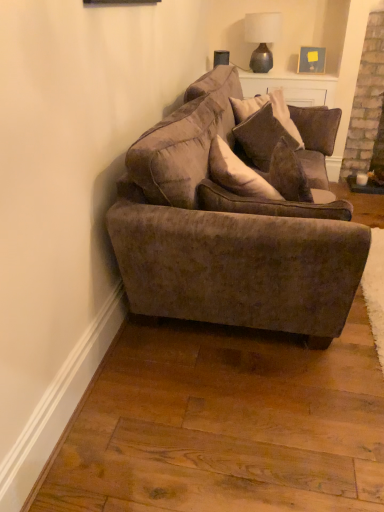
Question: In terms of size, does matte gray glass lamp at upper center appear bigger or smaller than velvet brown pillow at center?

Choices:
 (A) big
 (B) small

Answer: (A)

Question: From a real-world perspective, relative to velvet brown pillow at center, is matte gray glass lamp at upper center vertically above or below?

Choices:
 (A) above
 (B) below

Answer: (A)

Question: Which of these objects is positioned closest to the velvet brown pillow at center?

Choices:
 (A) velvet brown couch at center
 (B) matte gray glass lamp at upper center

Answer: (A)

Question: Which is farther from the velvet brown couch at center?

Choices:
 (A) matte gray glass lamp at upper center
 (B) velvet brown pillow at center

Answer: (A)